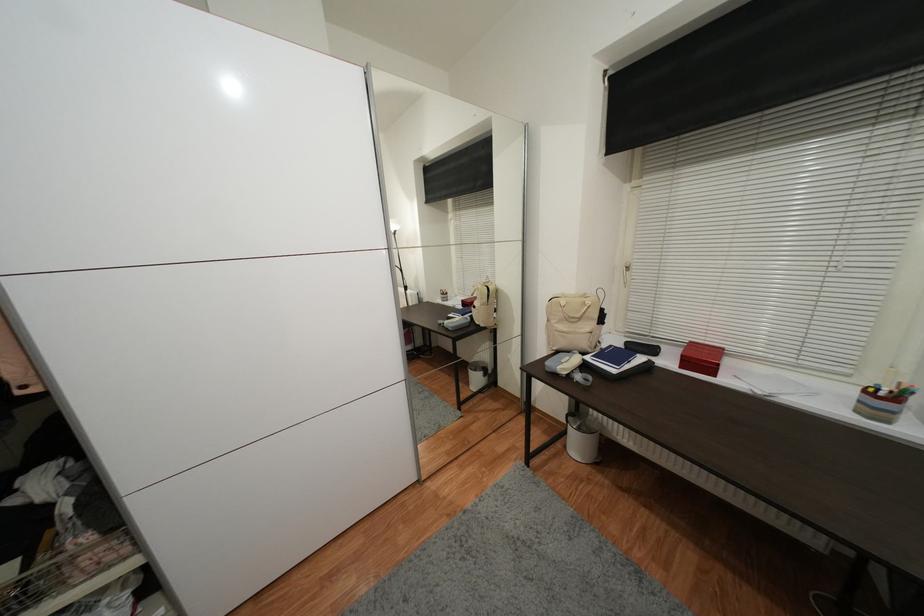
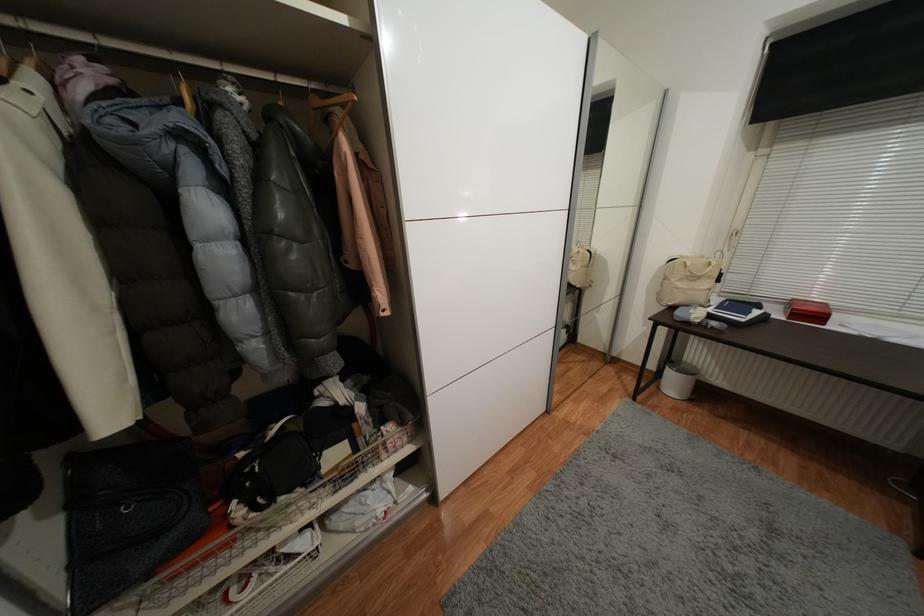
In the second image, find the point that corresponds to [489,330] in the first image.

(582, 291)